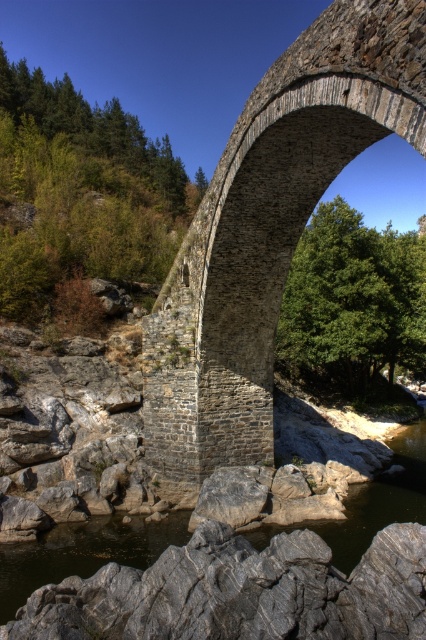
Between stone textured arch bridge at center and gray stone river at lower center, which one appears on the right side from the viewer's perspective?

gray stone river at lower center is more to the right.

Is point (218, 340) behind point (66, 556)?

Yes, point (218, 340) is farther from viewer.

Locate an element on the screen. Image resolution: width=426 pixels, height=640 pixels. stone textured arch bridge at center is located at coordinates (268, 228).